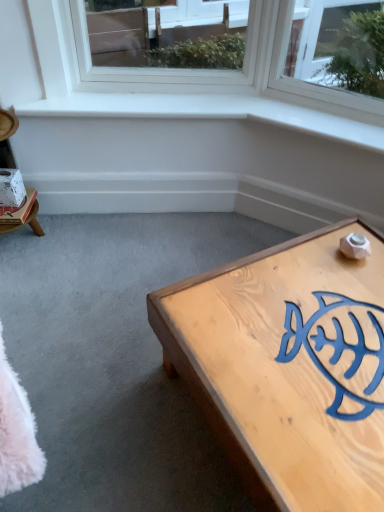
You are a GUI agent. You are given a task and a screenshot of the screen. Output one action in this format:
    pyautogui.click(x=<x>, y=<y>)
    Task: Click on the vacant space situated above light wood coffee table at lower right (from a real-world perspective)
    
    Given the screenshot: What is the action you would take?
    pyautogui.click(x=310, y=336)